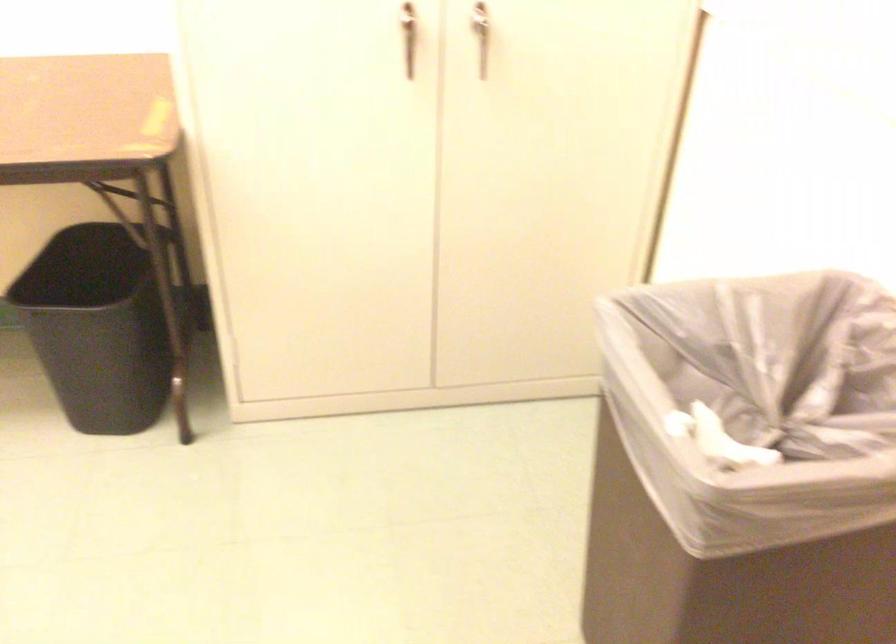
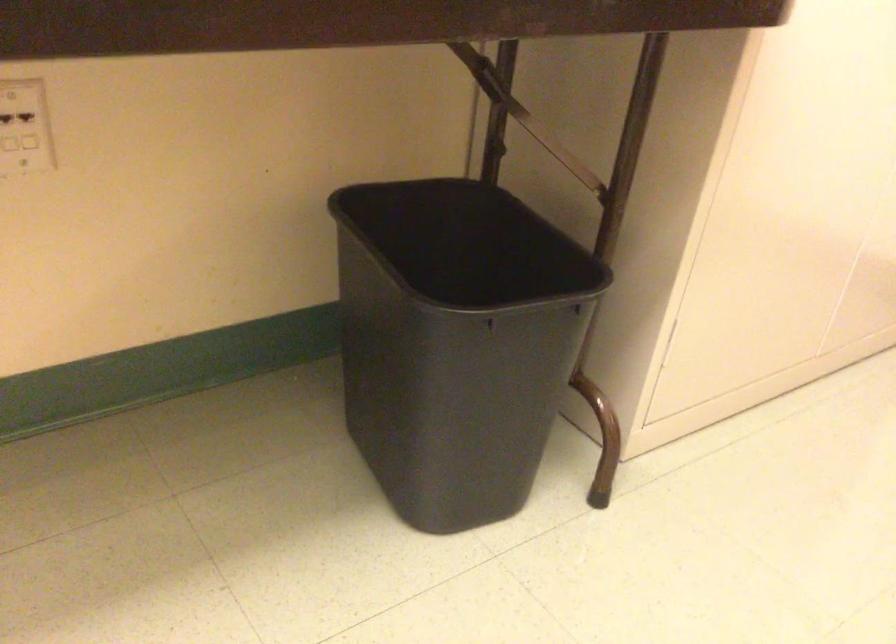
What movement of the cameraman would produce the second image?

The cameraman moved toward left, forward.